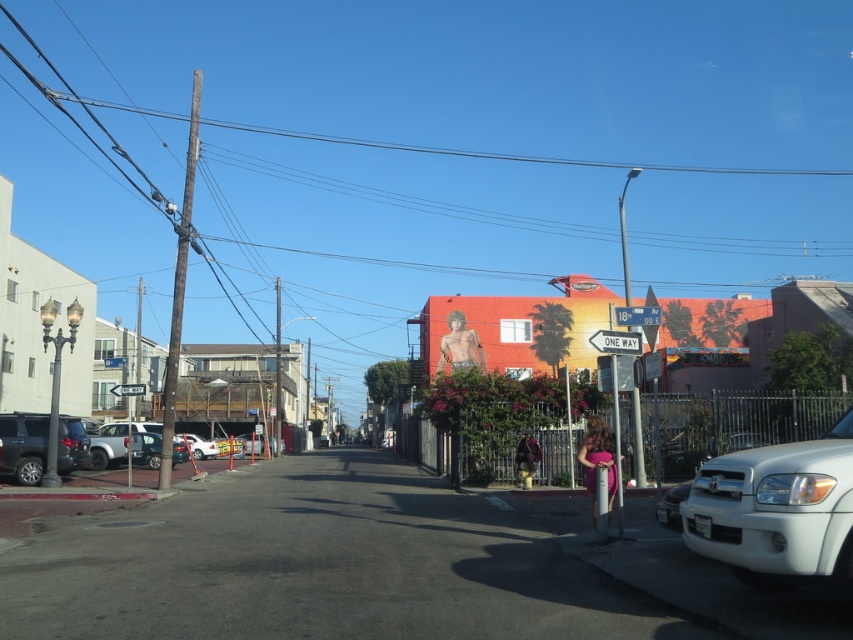
You are a delivery driver needing to park your vehicle on the street. The wooden utility pole at left and the white matte car at left are both in your path. Which object is wider, making it harder to maneuver around?

The wooden utility pole at left is wider than the white matte car at left, so it would be harder to maneuver around the wooden utility pole at left.

You are a pedestrian crossing the street and see the wooden utility pole at left and the white plastic street sign at center right. Which object is closer to you?

The wooden utility pole at left is closer to you because it is positioned over the white plastic street sign at center right, indicating it is in front of it from your perspective.